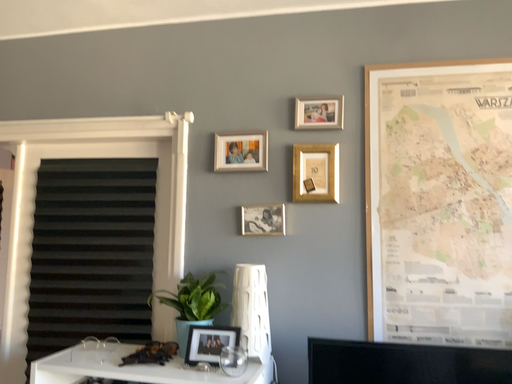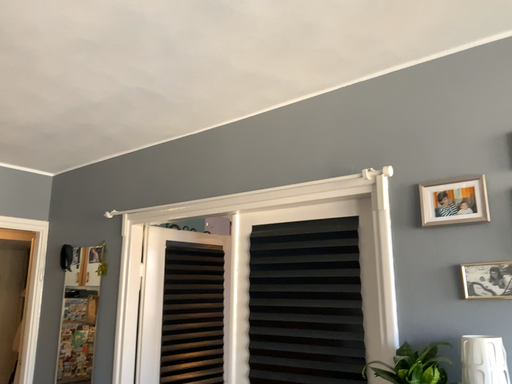
Question: Which way did the camera rotate in the video?

Choices:
 (A) rotated left
 (B) rotated right

Answer: (A)